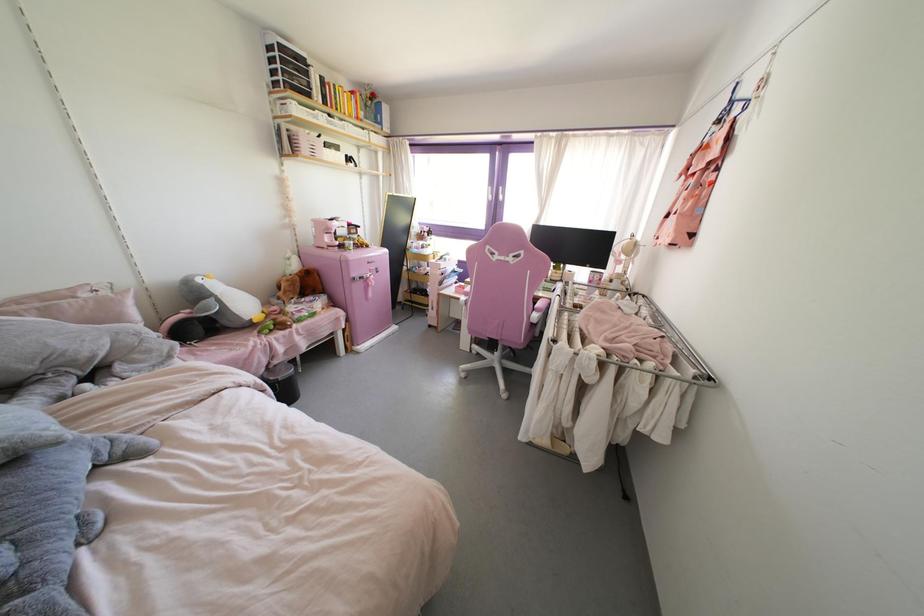
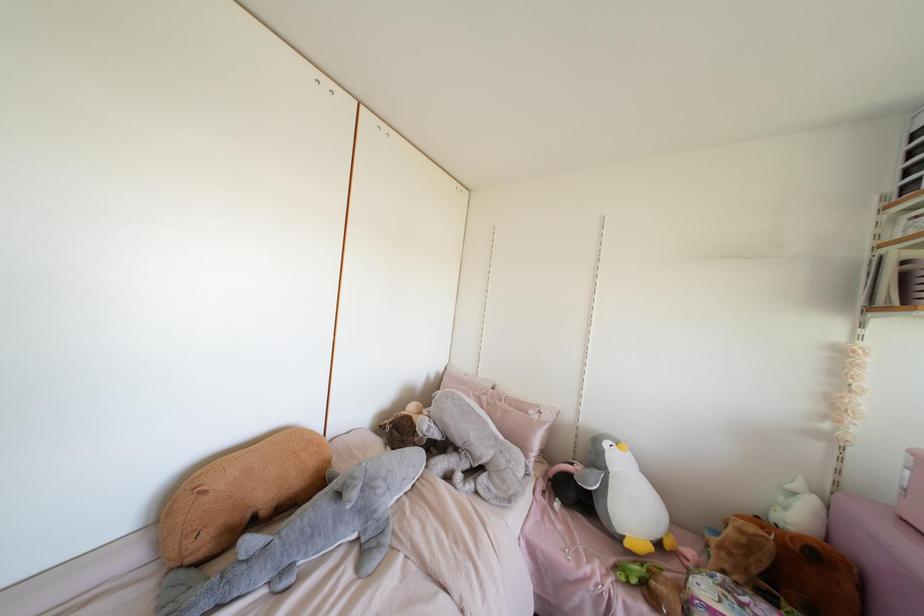
Locate, in the second image, the point that corresponds to the point at 286,280 in the first image.

(739, 531)